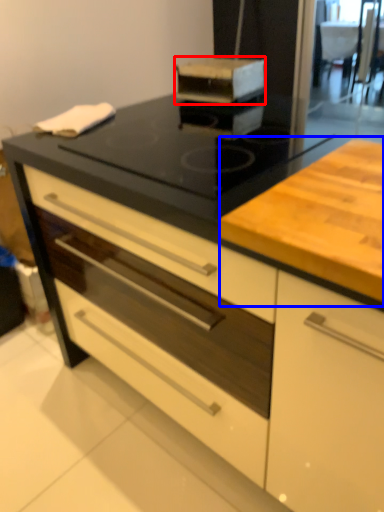
Question: Which object is further to the camera taking this photo, kitchen appliance (highlighted by a red box) or counter (highlighted by a blue box)?

Choices:
 (A) kitchen appliance
 (B) counter

Answer: (A)